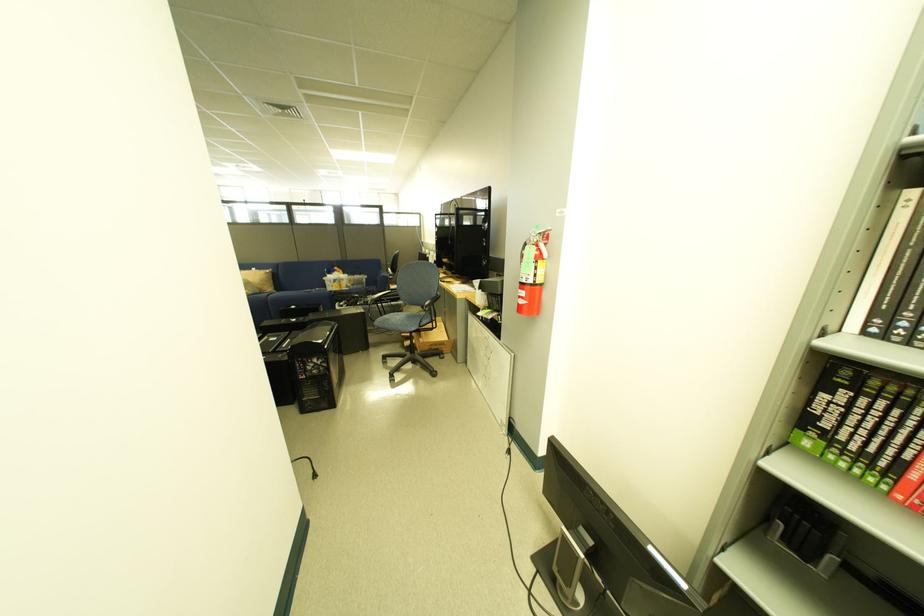
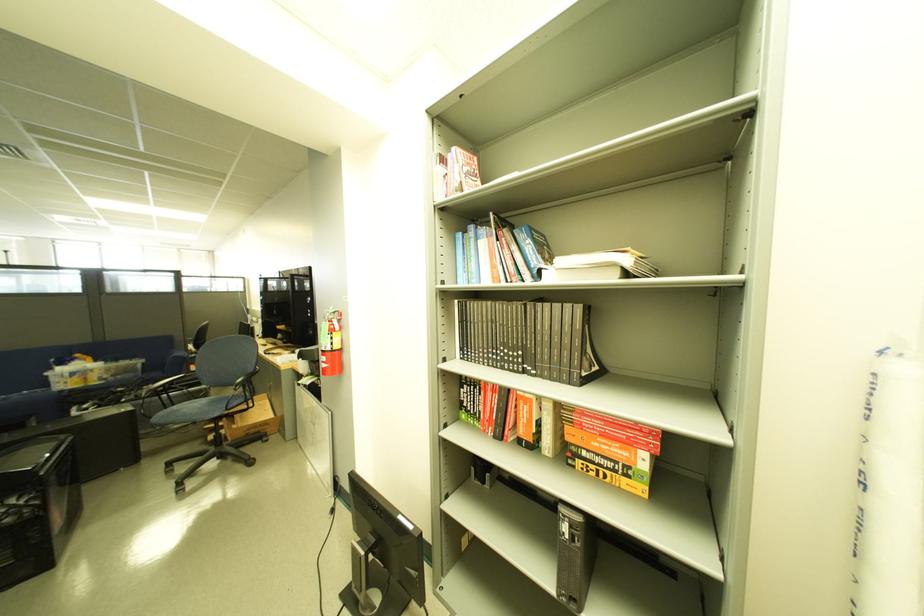
In the second image, find the point that corresponds to (347,289) in the first image.

(88, 385)